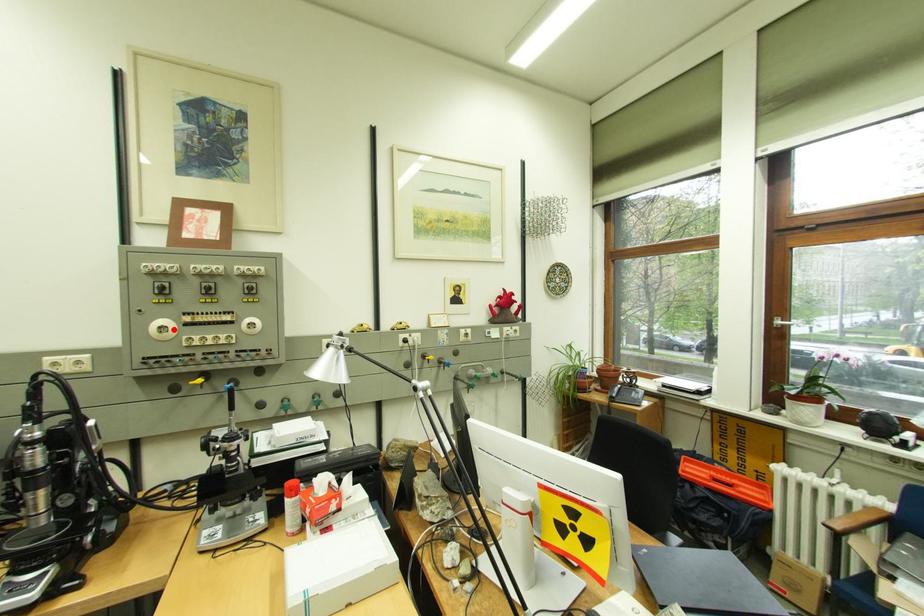
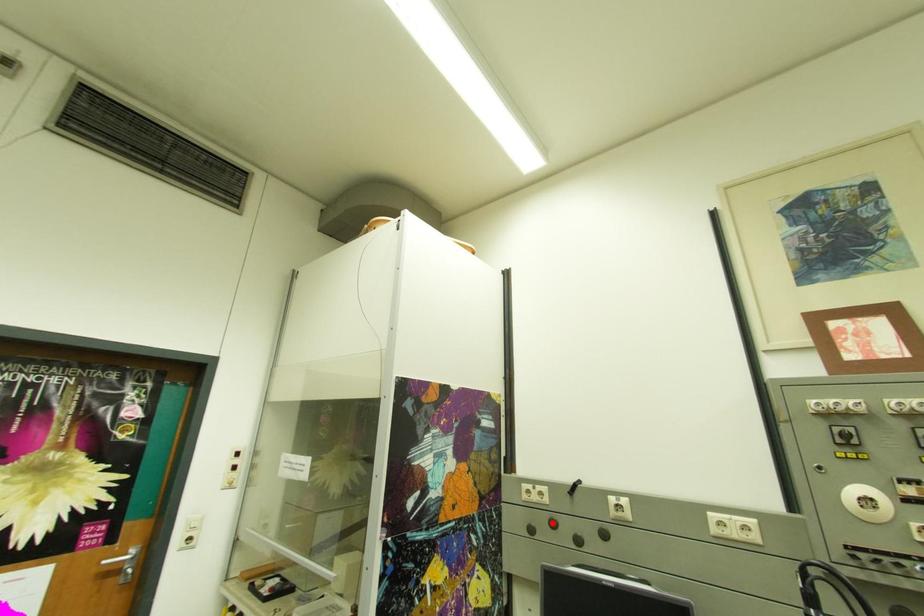
I am providing you with two images of the same scene from different viewpoints. A red point is marked on the first image and another point is marked on the second image. Is the red point in image1 aligned with the point shown in image2?

No